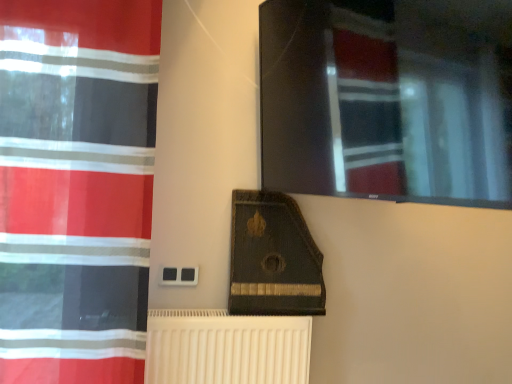
Question: From their relative heights in the image, would you say white ribbed radiator at lower center is taller or shorter than red striped curtain at left?

Choices:
 (A) short
 (B) tall

Answer: (A)

Question: Considering the positions of white ribbed radiator at lower center and red striped curtain at left in the image, is white ribbed radiator at lower center wider or thinner than red striped curtain at left?

Choices:
 (A) wide
 (B) thin

Answer: (A)

Question: Is white ribbed radiator at lower center to the left or to the right of red striped curtain at left in the image?

Choices:
 (A) left
 (B) right

Answer: (B)

Question: From their relative heights in the image, would you say red striped curtain at left is taller or shorter than white ribbed radiator at lower center?

Choices:
 (A) tall
 (B) short

Answer: (A)

Question: From a real-world perspective, is red striped curtain at left physically located above or below white ribbed radiator at lower center?

Choices:
 (A) below
 (B) above

Answer: (B)

Question: Looking at their shapes, would you say red striped curtain at left is wider or thinner than white ribbed radiator at lower center?

Choices:
 (A) wide
 (B) thin

Answer: (B)

Question: Considering the positions of red striped curtain at left and white ribbed radiator at lower center in the image, is red striped curtain at left bigger or smaller than white ribbed radiator at lower center?

Choices:
 (A) big
 (B) small

Answer: (A)